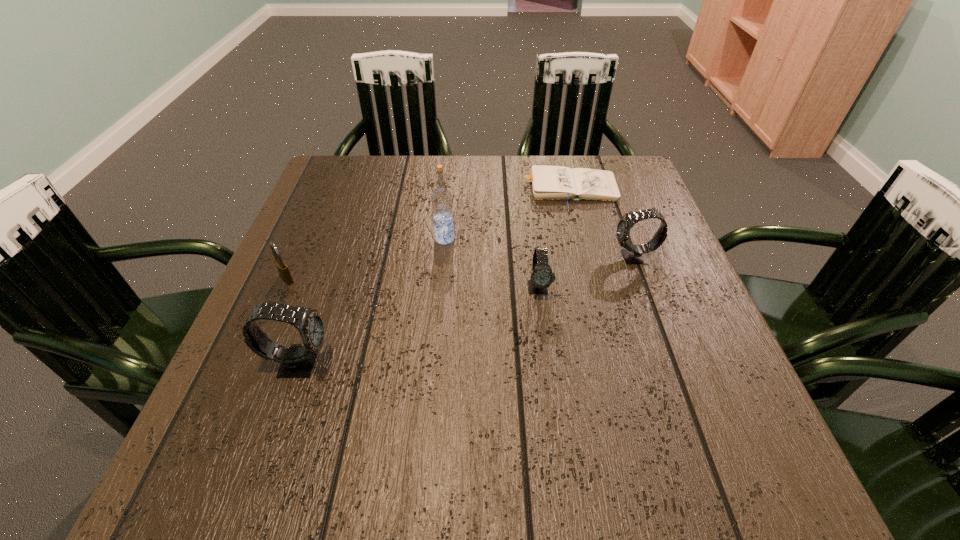
In order to click on object located at the near edge in this screenshot , I will do `click(297, 361)`.

Find the location of `watch that is positioned at the left edge`. watch that is positioned at the left edge is located at coordinates (297, 361).

Where is `padlock located at the left edge`? padlock located at the left edge is located at coordinates (281, 265).

Find the location of a particular element. This screenshot has width=960, height=540. watch that is at the right edge is located at coordinates (633, 254).

Locate an element on the screen. This screenshot has width=960, height=540. notebook present at the right edge is located at coordinates (548, 182).

Locate an element on the screen. object that is at the near left corner is located at coordinates (297, 361).

At what (x,y) coordinates should I click in order to perform the action: click on object that is at the far right corner. Please return your answer as a coordinate pair (x, y). This screenshot has width=960, height=540. Looking at the image, I should click on (548, 182).

In the image, there is a desktop. Where is `free space at the far edge`? Image resolution: width=960 pixels, height=540 pixels. free space at the far edge is located at coordinates (396, 198).

Locate an element on the screen. vacant space at the near edge of the desktop is located at coordinates (518, 389).

This screenshot has width=960, height=540. I want to click on vacant region at the right edge of the desktop, so click(694, 333).